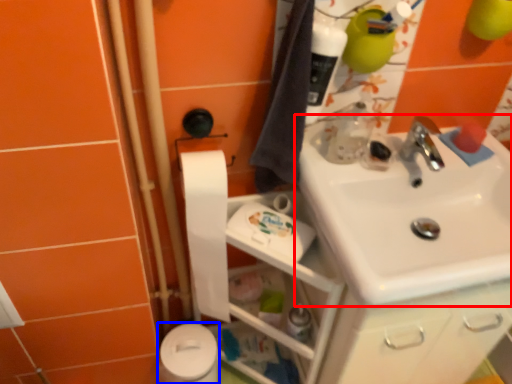
Question: Which of the following is the closest to the observer, sink (highlighted by a red box) or toilet paper (highlighted by a blue box)?

Choices:
 (A) sink
 (B) toilet paper

Answer: (A)